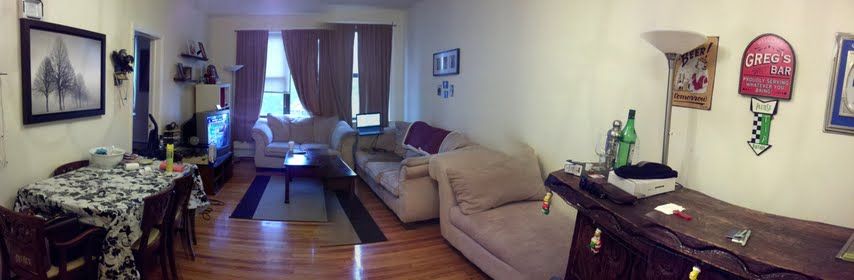
You are a GUI agent. You are given a task and a screenshot of the screen. Output one action in this format:
    pyautogui.click(x=<x>, y=<y>)
    Task: Click on the table
    
    Given the screenshot: What is the action you would take?
    pyautogui.click(x=114, y=184)